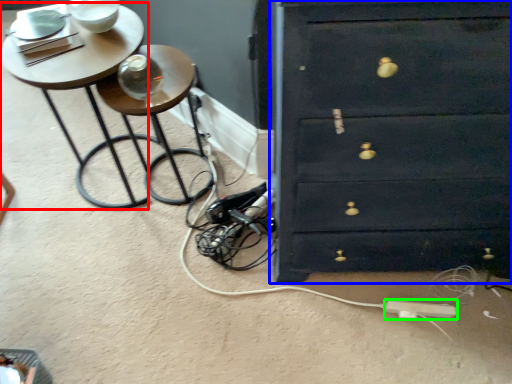
Question: Which is nearer to the table (highlighted by a red box)? chest of drawers (highlighted by a blue box) or extension cord (highlighted by a green box).

Choices:
 (A) chest of drawers
 (B) extension cord

Answer: (A)